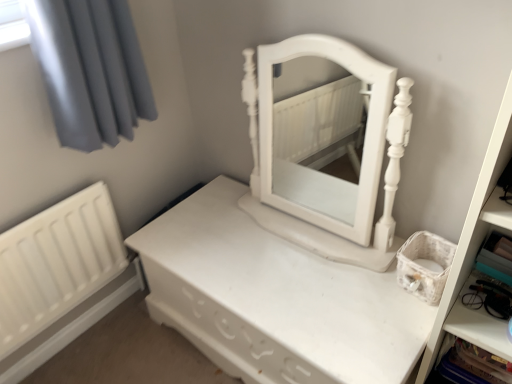
Measure the distance between point (100, 286) and camera.

Point (100, 286) and camera are 1.53 meters apart from each other.

What do you see at coordinates (476, 251) in the screenshot? I see `white matte bookshelf at right` at bounding box center [476, 251].

The image size is (512, 384). I want to click on white matte/wooden nightstand at center, so click(274, 299).

Measure the distance between point (488,379) and camera.

Point (488,379) and camera are 1.05 meters apart.

This screenshot has height=384, width=512. What are the coordinates of `white matte radiator at lower left` in the screenshot? It's located at (57, 263).

Is white plastic cabinet at lower right next to white matte/wooden nightstand at center?

No, white plastic cabinet at lower right is not making contact with white matte/wooden nightstand at center.

Considering the relative positions of white plastic cabinet at lower right and white matte/wooden nightstand at center in the image provided, is white plastic cabinet at lower right to the right of white matte/wooden nightstand at center from the viewer's perspective?

Yes.

Can you tell me how much white plastic cabinet at lower right and white matte/wooden nightstand at center differ in facing direction?

The angular difference between white plastic cabinet at lower right and white matte/wooden nightstand at center is 0.278 degrees.

Find the location of a particular element. The height and width of the screenshot is (384, 512). cabinet lying on the right of white matte/wooden nightstand at center is located at coordinates (480, 362).

How much distance is there between white matte/wooden nightstand at center and white plastic cabinet at lower right?

white matte/wooden nightstand at center is 20.94 inches from white plastic cabinet at lower right.

Considering the positions of points (151, 288) and (498, 369), is point (151, 288) closer to camera compared to point (498, 369)?

No, it is not.

In the scene shown: From a real-world perspective, is white matte/wooden nightstand at center physically located above or below white plastic cabinet at lower right?

In terms of real-world spatial position, white matte/wooden nightstand at center is below white plastic cabinet at lower right.

Is white matte/wooden nightstand at center oriented away from white plastic cabinet at lower right?

No.

Considering the relative sizes of white plastic cabinet at lower right and white matte radiator at lower left in the image provided, is white plastic cabinet at lower right wider than white matte radiator at lower left?

Yes, white plastic cabinet at lower right is wider than white matte radiator at lower left.

Which is more to the left, white plastic cabinet at lower right or white matte radiator at lower left?

From the viewer's perspective, white matte radiator at lower left appears more on the left side.

At what (x,y) coordinates should I click in order to perform the action: click on cabinet below the white matte radiator at lower left (from the image's perspective). Please return your answer as a coordinate pair (x, y). Looking at the image, I should click on coord(480,362).

Could white plastic cabinet at lower right be considered to be inside white matte bookshelf at right?

Yes, white plastic cabinet at lower right is a part of white matte bookshelf at right.

From the image's perspective, which is below, white matte bookshelf at right or white plastic cabinet at lower right?

From the image's view, white plastic cabinet at lower right is below.

Between white matte bookshelf at right and white plastic cabinet at lower right, which one has larger width?

Wider between the two is white matte bookshelf at right.

Considering the positions of point (456, 261) and point (462, 356), is point (456, 261) closer or farther from the camera than point (462, 356)?

Point (456, 261).

Is white plastic cabinet at lower right far from white matte bookshelf at right?

white plastic cabinet at lower right is near white matte bookshelf at right, not far away.

Is white plastic cabinet at lower right positioned beyond the bounds of white matte bookshelf at right?

No.

From the image's perspective, which is below, white plastic cabinet at lower right or white matte bookshelf at right?

From the image's view, white plastic cabinet at lower right is below.

Looking at their sizes, would you say white plastic cabinet at lower right is wider or thinner than white matte bookshelf at right?

In the image, white plastic cabinet at lower right appears to be more narrow than white matte bookshelf at right.

Can you tell me how much white matte radiator at lower left and white plastic cabinet at lower right differ in facing direction?

The facing directions of white matte radiator at lower left and white plastic cabinet at lower right are 91 degrees apart.

Does white matte radiator at lower left have a smaller size compared to white plastic cabinet at lower right?

No, white matte radiator at lower left is not smaller than white plastic cabinet at lower right.

Is white matte radiator at lower left not inside white plastic cabinet at lower right?

Yes, white matte radiator at lower left is not within white plastic cabinet at lower right.

Consider the image. Who is bigger, white matte bookshelf at right or white matte radiator at lower left?

white matte bookshelf at right.

At what (x,y) coordinates should I click in order to perform the action: click on radiator on the left side of white matte bookshelf at right. Please return your answer as a coordinate pair (x, y). Looking at the image, I should click on tap(57, 263).

Would you consider white matte bookshelf at right to be distant from white matte radiator at lower left?

Indeed, white matte bookshelf at right is not near white matte radiator at lower left.

Is point (495, 123) positioned before point (13, 241)?

Yes.

You are a GUI agent. You are given a task and a screenshot of the screen. Output one action in this format:
    pyautogui.click(x=<x>, y=<y>)
    Task: Click on the nightstand on the left of white plastic cabinet at lower right
    
    Given the screenshot: What is the action you would take?
    pyautogui.click(x=274, y=299)

Locate an element on the screen. Image resolution: width=512 pixels, height=384 pixels. nightstand above the white plastic cabinet at lower right (from the image's perspective) is located at coordinates (274, 299).

Based on the photo, considering their positions, is white plastic cabinet at lower right positioned closer to white matte radiator at lower left than white matte bookshelf at right?

Among the two, white matte bookshelf at right is located nearer to white matte radiator at lower left.

Estimate the real-world distances between objects in this image. Which object is closer to white plastic cabinet at lower right, white matte bookshelf at right or white matte radiator at lower left?

Among the two, white matte bookshelf at right is located nearer to white plastic cabinet at lower right.

Based on their spatial positions, is white matte radiator at lower left or white matte/wooden nightstand at center further from white plastic cabinet at lower right?

white matte radiator at lower left is positioned further to the anchor white plastic cabinet at lower right.

Which object lies further to the anchor point white matte bookshelf at right, white matte/wooden nightstand at center or white plastic cabinet at lower right?

white matte/wooden nightstand at center lies further to white matte bookshelf at right than the other object.

Which object lies further to the anchor point white matte/wooden nightstand at center, white matte bookshelf at right or white plastic cabinet at lower right?

white plastic cabinet at lower right is further to white matte/wooden nightstand at center.

Which object lies further to the anchor point white matte/wooden nightstand at center, white matte radiator at lower left or white matte bookshelf at right?

white matte bookshelf at right is further to white matte/wooden nightstand at center.

Looking at the image, which one is located further to white plastic cabinet at lower right, white matte/wooden nightstand at center or white matte bookshelf at right?

white matte/wooden nightstand at center.

Looking at the image, which one is located further to white matte bookshelf at right, white plastic cabinet at lower right or white matte radiator at lower left?

white matte radiator at lower left lies further to white matte bookshelf at right than the other object.

I want to click on nightstand between white matte radiator at lower left and white matte bookshelf at right from left to right, so click(274, 299).

You are a GUI agent. You are given a task and a screenshot of the screen. Output one action in this format:
    pyautogui.click(x=<x>, y=<y>)
    Task: Click on the cabinet between white matte radiator at lower left and white matte bookshelf at right from left to right
    
    Given the screenshot: What is the action you would take?
    pyautogui.click(x=480, y=362)

This screenshot has height=384, width=512. Find the location of `nightstand between white matte radiator at lower left and white plastic cabinet at lower right in the horizontal direction`. nightstand between white matte radiator at lower left and white plastic cabinet at lower right in the horizontal direction is located at coordinates (274, 299).

At what (x,y) coordinates should I click in order to perform the action: click on cabinet between white matte/wooden nightstand at center and white matte bookshelf at right. Please return your answer as a coordinate pair (x, y). Looking at the image, I should click on (480, 362).